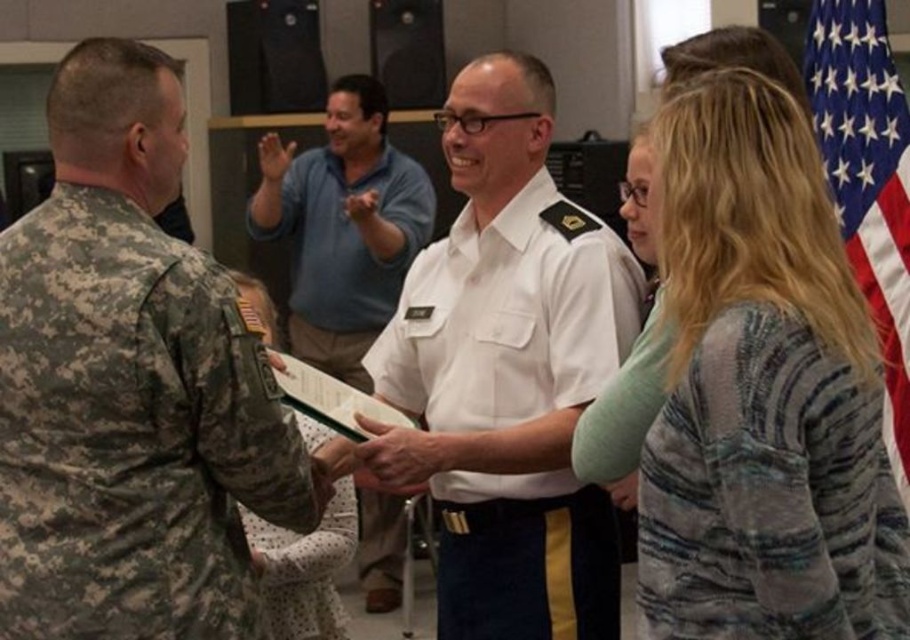
Please look at the image and identify the object located at the coordinates point (762, 392). What is it?

The object at point (762, 392) is the striped sweater at center.

You are an event photographer at a military ceremony. You need to capture a clear photo of both the striped sweater at center and the white uniform shirt at center. Which one should you focus on first to ensure it is in the foreground?

The striped sweater at center should be focused on first because it is positioned under the white uniform shirt at center, meaning it is closer to the camera and thus in the foreground.